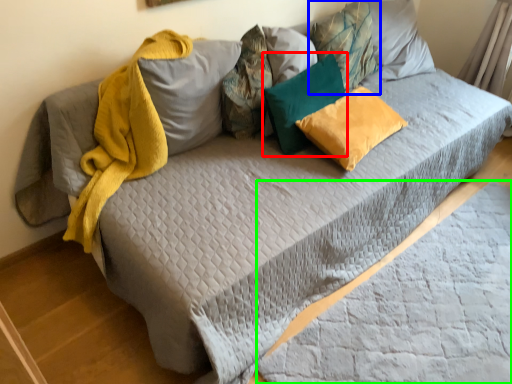
Question: Which object is the closest to the pillow (highlighted by a red box)? Choose among these: pillow (highlighted by a blue box) or sheet (highlighted by a green box).

Choices:
 (A) pillow
 (B) sheet

Answer: (A)